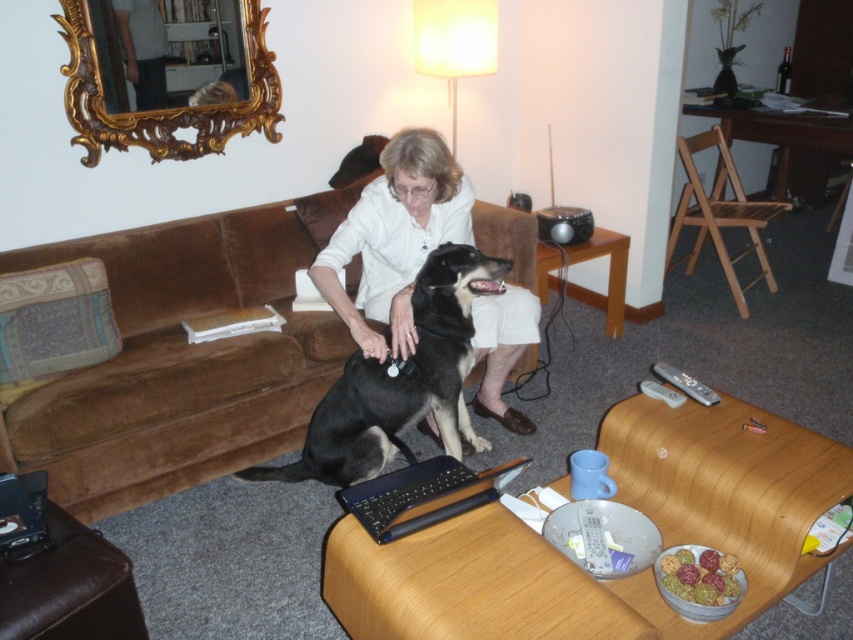
Please describe the position of the black smooth dog at center in terms of its coordinates in the image. The coordinate system has the origin at the bottom left corner of the image, with the x and y axes increasing to the right and up respectively. The coordinates are normalized between 0 and 1. Use the format x,y for the answer.

The black smooth dog at center is located at coordinates (399, 380).

Consider the image. You are a delivery person entering the living room and need to place a package on the surface closest to you. Which object should you choose between the brown velvety couch at center and the black plastic laptop at center?

The brown velvety couch at center is closer to you than the black plastic laptop at center, so you should place the package on the brown velvety couch at center.

You are a delivery person who needs to place a small package on the coffee table. The coffee table has a black smooth dog at center and a black plastic laptop at center. Which object should you move to make space?

The black smooth dog at center is above the black plastic laptop at center, so you should move the black smooth dog at center to make space on the coffee table.